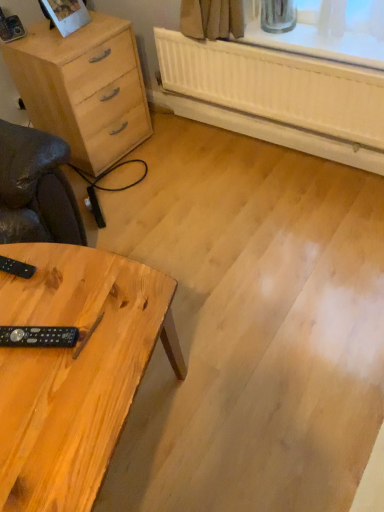
This screenshot has height=512, width=384. What are the coordinates of `vacant area on top of natural wood table at lower left (from a real-world perspective)` in the screenshot? It's located at (56, 339).